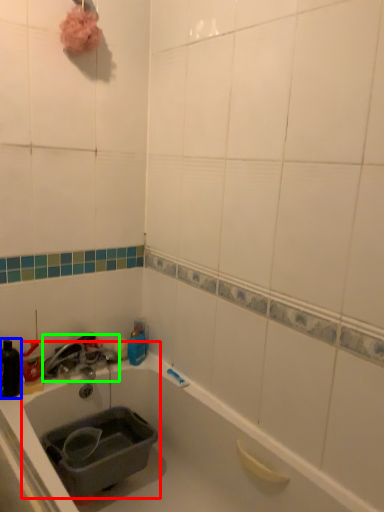
Question: Estimate the real-world distances between objects in this image. Which object is farther from sink (highlighted by a red box), bottle (highlighted by a blue box) or faucet (highlighted by a green box)?

Choices:
 (A) bottle
 (B) faucet

Answer: (A)